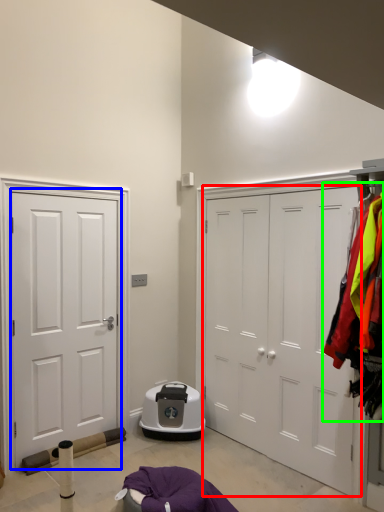
Question: Which is farther away from door (highlighted by a red box)? door (highlighted by a blue box) or laundry (highlighted by a green box)?

Choices:
 (A) door
 (B) laundry

Answer: (A)